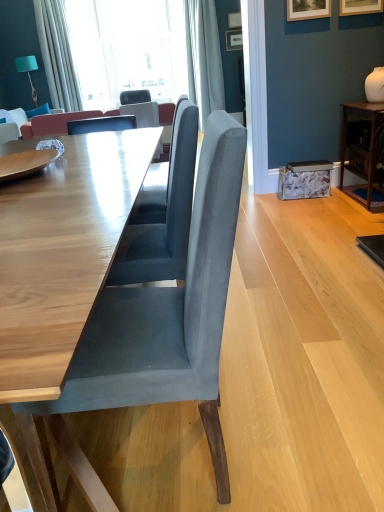
Find the location of a particular element. The image size is (384, 512). vacant space that's between dark wood table at right, which is the second table from left to right, and wooden table at center, which is the 2th table from right to left is located at coordinates (294, 250).